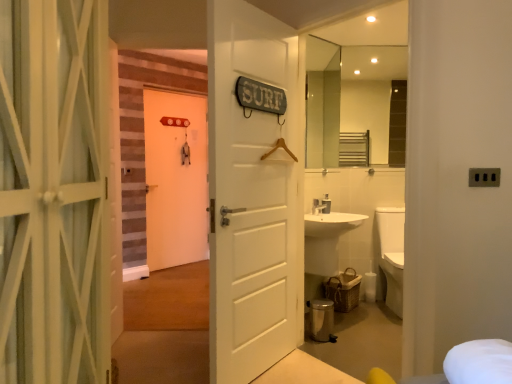
Question: Does glossy glass mirror at upper center, acting as the 1th mirror starting from the right, have a smaller size compared to clear glass mirror at upper right, which appears as the 2th mirror when viewed from the right?

Choices:
 (A) yes
 (B) no

Answer: (B)

Question: Does glossy glass mirror at upper center, acting as the 1th mirror starting from the right, appear on the right side of clear glass mirror at upper right, which ranks as the 1th mirror in left-to-right order?

Choices:
 (A) yes
 (B) no

Answer: (A)

Question: Can you confirm if glossy glass mirror at upper center, acting as the 1th mirror starting from the right, is wider than clear glass mirror at upper right, which ranks as the 1th mirror in left-to-right order?

Choices:
 (A) no
 (B) yes

Answer: (B)

Question: Does glossy glass mirror at upper center, which is the 2th mirror in left-to-right order, turn towards clear glass mirror at upper right, which appears as the 2th mirror when viewed from the right?

Choices:
 (A) yes
 (B) no

Answer: (B)

Question: Does glossy glass mirror at upper center, acting as the 1th mirror starting from the right, have a greater height compared to clear glass mirror at upper right, which ranks as the 1th mirror in left-to-right order?

Choices:
 (A) yes
 (B) no

Answer: (A)

Question: From the image's perspective, is white matte door at center, which is the 2th door from back to front, located above or below glossy glass mirror at upper center, which is the 2th mirror in left-to-right order?

Choices:
 (A) above
 (B) below

Answer: (B)

Question: Considering the positions of white matte door at center, the 2th door from the front, and glossy glass mirror at upper center, acting as the 1th mirror starting from the right, in the image, is white matte door at center, the 2th door from the front, taller or shorter than glossy glass mirror at upper center, acting as the 1th mirror starting from the right,?

Choices:
 (A) tall
 (B) short

Answer: (A)

Question: Does point (283, 46) appear closer or farther from the camera than point (371, 160)?

Choices:
 (A) closer
 (B) farther

Answer: (A)

Question: Is white matte door at center, the 2th door from the front, inside or outside of glossy glass mirror at upper center, acting as the 1th mirror starting from the right?

Choices:
 (A) inside
 (B) outside

Answer: (B)

Question: From a real-world perspective, relative to glossy glass mirror at upper center, acting as the 1th mirror starting from the right, is white matte door at center, which is counted as the 1th door, starting from the back, vertically above or below?

Choices:
 (A) below
 (B) above

Answer: (A)

Question: From the image's perspective, relative to glossy glass mirror at upper center, which is the 2th mirror in left-to-right order, is white matte door at center, the first door when ordered from left to right, above or below?

Choices:
 (A) below
 (B) above

Answer: (A)

Question: Is white matte door at center, placed as the 3th door when sorted from right to left, in front of or behind glossy glass mirror at upper center, acting as the 1th mirror starting from the right, in the image?

Choices:
 (A) front
 (B) behind

Answer: (B)

Question: In terms of size, does white matte door at center, which ranks as the 3th door in front-to-back order, appear bigger or smaller than glossy glass mirror at upper center, acting as the 1th mirror starting from the right?

Choices:
 (A) small
 (B) big

Answer: (B)

Question: From a real-world perspective, is glossy glass mirror at upper center, which is the 2th mirror in left-to-right order, above or below white matte door at center, which is counted as the 1th door, starting from the back?

Choices:
 (A) above
 (B) below

Answer: (A)

Question: Is glossy glass mirror at upper center, acting as the 1th mirror starting from the right, situated inside white matte door at center, which ranks as the 3th door in front-to-back order, or outside?

Choices:
 (A) outside
 (B) inside

Answer: (A)